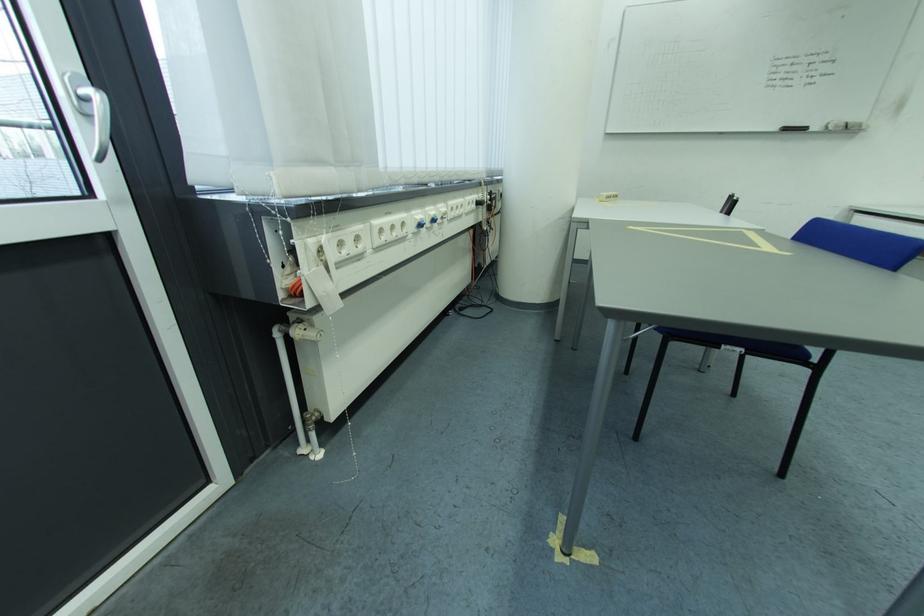
Where would you pull the silver door handle? Please return your answer as a coordinate pair (x, y).

(91, 111)